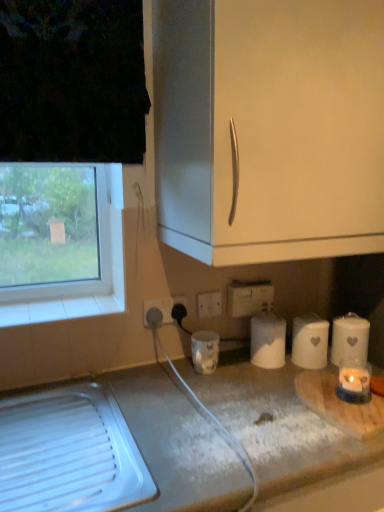
Find the location of a particular element. This screenshot has height=512, width=384. free space above white matte countertop at lower center (from a real-world perspective) is located at coordinates (107, 439).